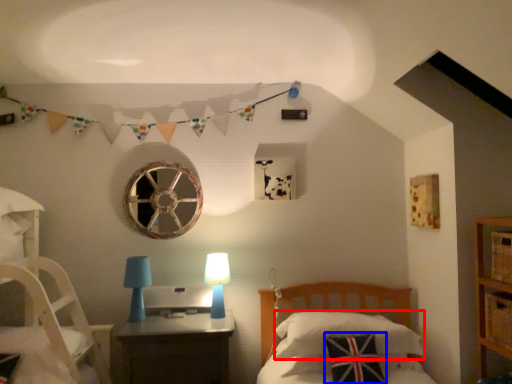
Question: Among these objects, which one is nearest to the camera, pillow (highlighted by a red box) or pillow (highlighted by a blue box)?

Choices:
 (A) pillow
 (B) pillow

Answer: (B)